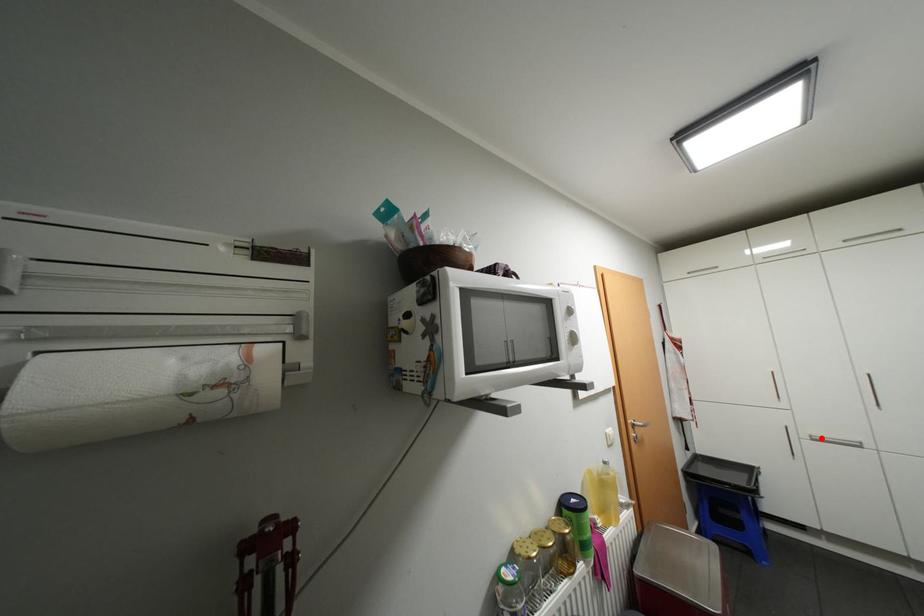
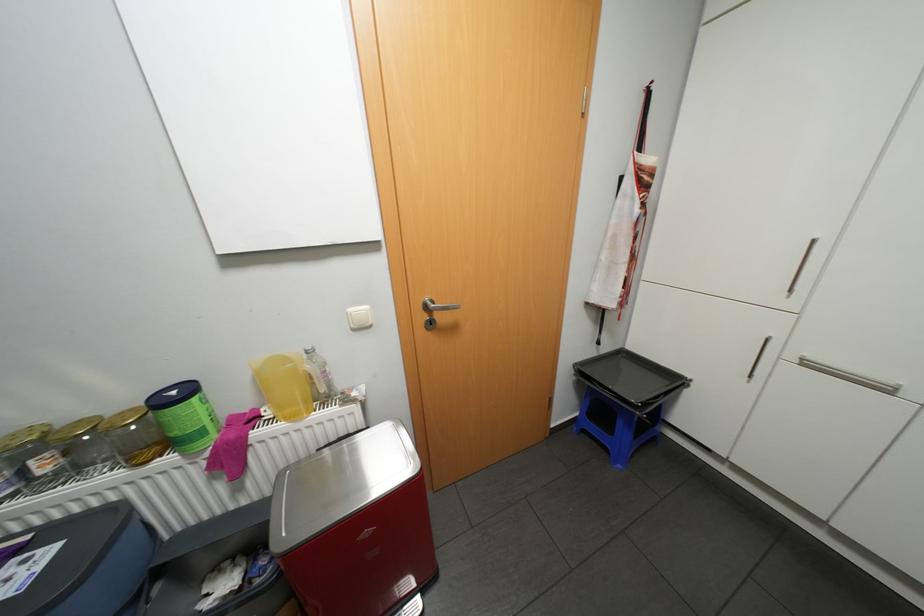
The point at the highlighted location is marked in the first image. Where is the corresponding point in the second image?

(813, 363)